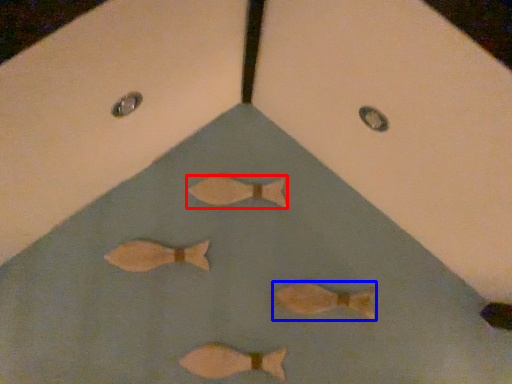
Question: Which point is closer to the camera, fish (highlighted by a red box) or fish (highlighted by a blue box)?

Choices:
 (A) fish
 (B) fish

Answer: (B)